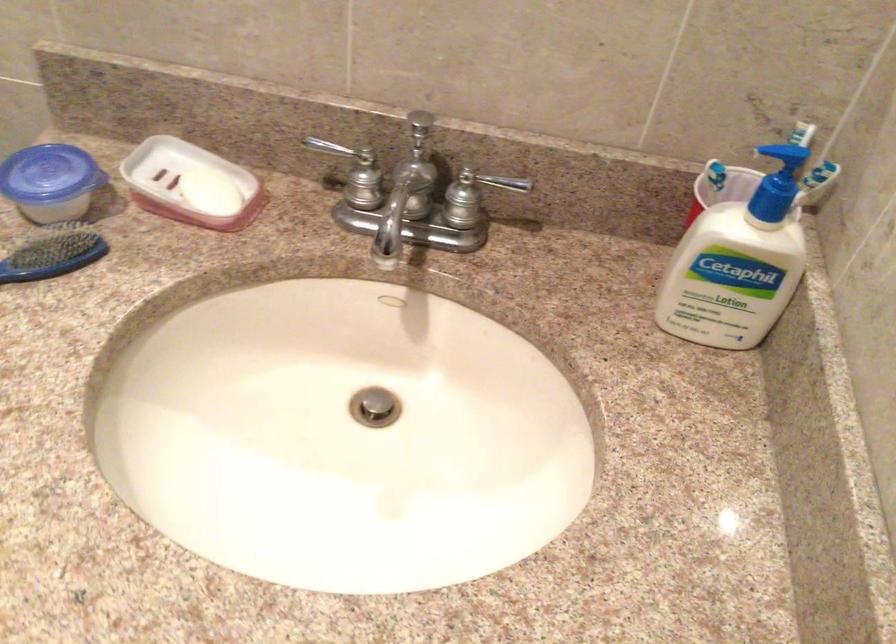
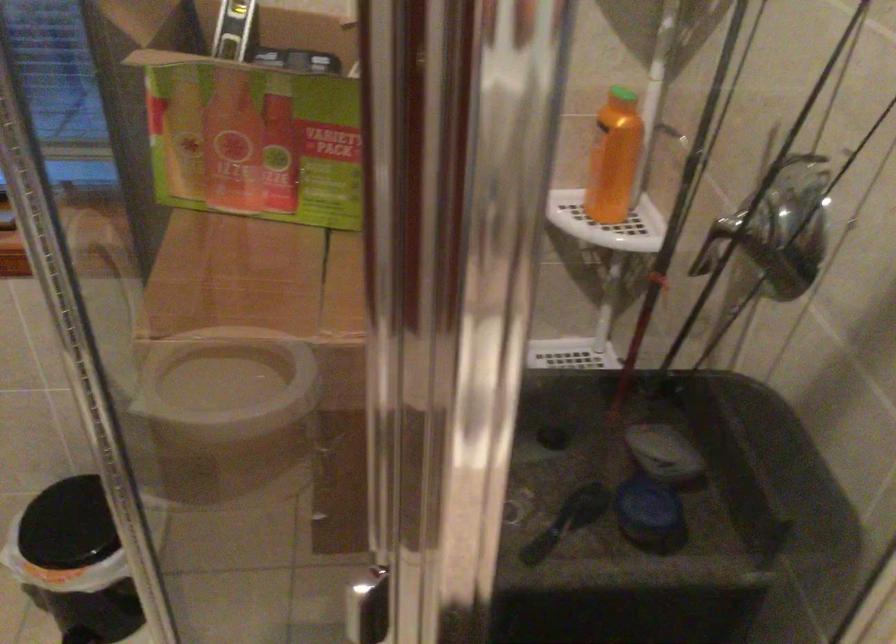
Question: The camera is either moving clockwise (left) or counter-clockwise (right) around the object. The first image is from the beginning of the video and the second image is from the end. Is the camera moving left or right when shooting the video?

Choices:
 (A) Left
 (B) Right

Answer: (B)